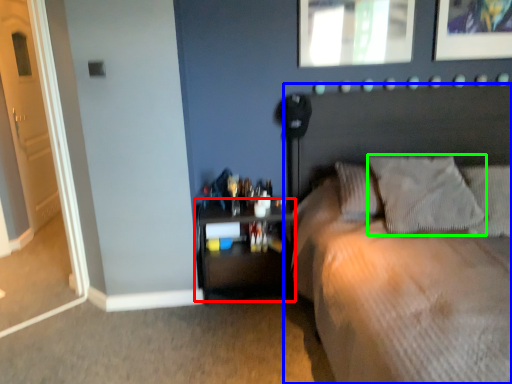
Question: Which object is positioned farthest from nightstand (highlighted by a red box)? Select from bed (highlighted by a blue box) and pillow (highlighted by a green box).

Choices:
 (A) bed
 (B) pillow

Answer: (B)